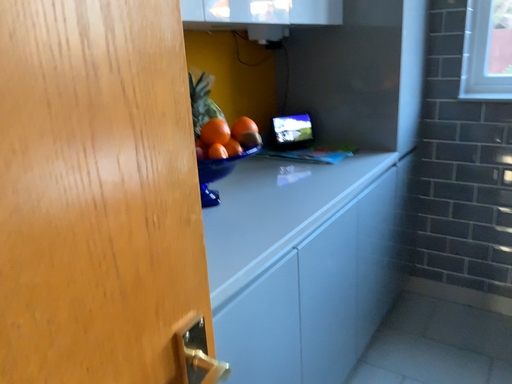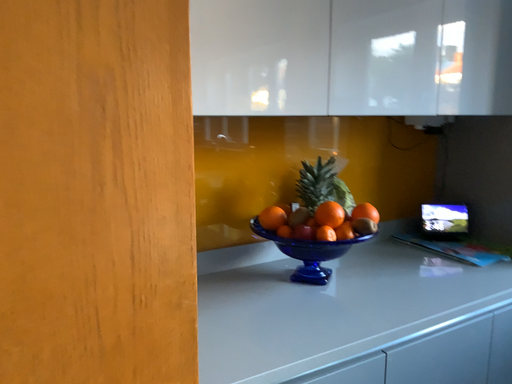
Question: Which way did the camera rotate in the video?

Choices:
 (A) rotated left
 (B) rotated right

Answer: (A)